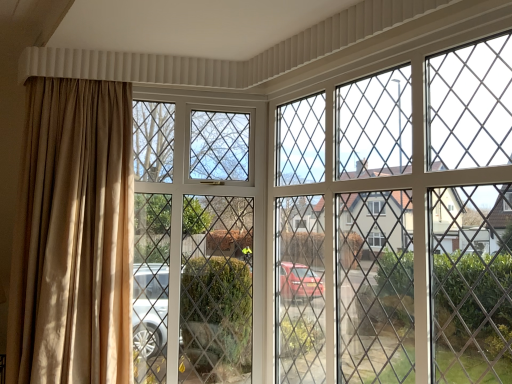
Question: Does clear glass screen door at center, the 2th screen door viewed from the right, have a smaller size compared to clear glass screen door at upper center, which is the first screen door from right to left?

Choices:
 (A) no
 (B) yes

Answer: (B)

Question: From the image's perspective, is clear glass screen door at center, the 2th screen door viewed from the right, beneath clear glass screen door at upper center, which is the first screen door from right to left?

Choices:
 (A) no
 (B) yes

Answer: (B)

Question: Is clear glass screen door at center, the 2th screen door viewed from the right, placed right next to clear glass screen door at upper center, which is the 2th screen door in left-to-right order?

Choices:
 (A) yes
 (B) no

Answer: (B)

Question: Considering the relative sizes of clear glass screen door at center, the 2th screen door viewed from the right, and clear glass screen door at upper center, which is the first screen door from right to left, in the image provided, is clear glass screen door at center, the 2th screen door viewed from the right, shorter than clear glass screen door at upper center, which is the first screen door from right to left,?

Choices:
 (A) yes
 (B) no

Answer: (B)

Question: Is clear glass screen door at center, the 2th screen door viewed from the right, to the right of clear glass screen door at upper center, which is the 2th screen door in left-to-right order, from the viewer's perspective?

Choices:
 (A) yes
 (B) no

Answer: (B)

Question: Is clear glass screen door at center, the 2th screen door viewed from the right, wider than clear glass screen door at upper center, which is the 2th screen door in left-to-right order?

Choices:
 (A) no
 (B) yes

Answer: (B)

Question: Does clear glass screen door at center, the 1th screen door when ordered from left to right, have a lesser width compared to beige fabric curtain at left?

Choices:
 (A) yes
 (B) no

Answer: (A)

Question: Does clear glass screen door at center, the 2th screen door viewed from the right, appear on the right side of beige fabric curtain at left?

Choices:
 (A) yes
 (B) no

Answer: (A)

Question: Is the position of clear glass screen door at center, the 1th screen door when ordered from left to right, less distant than that of beige fabric curtain at left?

Choices:
 (A) yes
 (B) no

Answer: (B)

Question: Would you say clear glass screen door at center, the 1th screen door when ordered from left to right, contains beige fabric curtain at left?

Choices:
 (A) yes
 (B) no

Answer: (B)

Question: From the image's perspective, would you say clear glass screen door at center, the 1th screen door when ordered from left to right, is shown under beige fabric curtain at left?

Choices:
 (A) no
 (B) yes

Answer: (B)

Question: Can you confirm if clear glass screen door at center, the 2th screen door viewed from the right, is shorter than beige fabric curtain at left?

Choices:
 (A) no
 (B) yes

Answer: (A)

Question: Would you say clear glass screen door at upper center, which is the 2th screen door in left-to-right order, is outside beige fabric curtain at left?

Choices:
 (A) yes
 (B) no

Answer: (A)